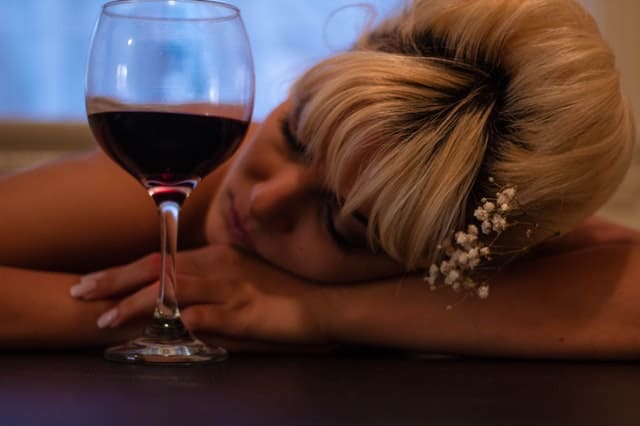
Identify the location of wine glass. 180,54.